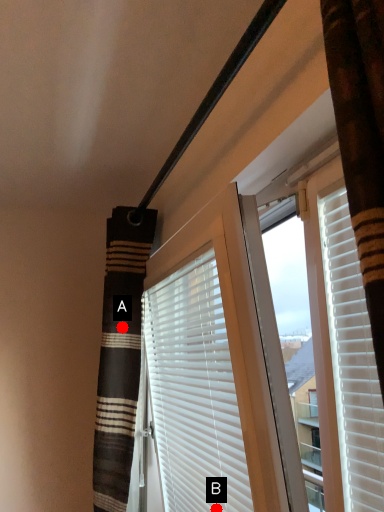
Question: Two points are circled on the image, labeled by A and B beside each circle. Which point is farther from the camera taking this photo?

Choices:
 (A) A is further
 (B) B is further

Answer: (A)